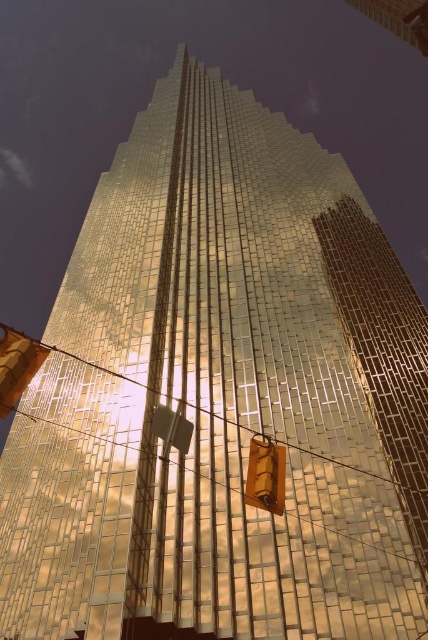
Question: Which point is farther to the camera?

Choices:
 (A) pos(270,496)
 (B) pos(8,378)

Answer: (A)

Question: From the image, what is the correct spatial relationship of matte orange traffic light at lower left in relation to metallic gold traffic light at center?

Choices:
 (A) below
 (B) above

Answer: (B)

Question: Can you confirm if matte orange traffic light at lower left is positioned below metallic gold traffic light at center?

Choices:
 (A) no
 (B) yes

Answer: (A)

Question: Is matte orange traffic light at lower left to the left of metallic gold traffic light at center from the viewer's perspective?

Choices:
 (A) yes
 (B) no

Answer: (A)